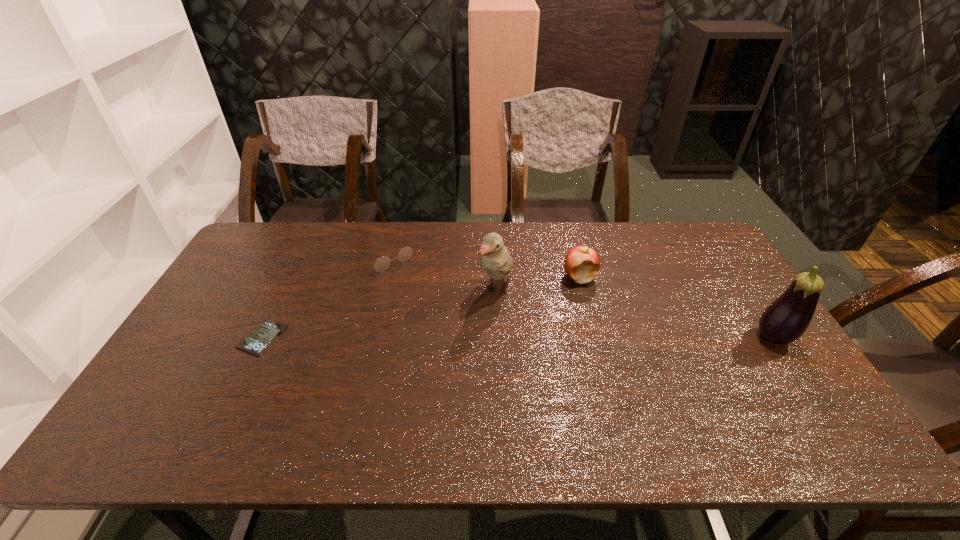
The width and height of the screenshot is (960, 540). Find the location of `the shortest object`. the shortest object is located at coordinates (268, 331).

At what (x,y) coordinates should I click in order to perform the action: click on the leftmost object. Please return your answer as a coordinate pair (x, y). Looking at the image, I should click on (268, 331).

You are a GUI agent. You are given a task and a screenshot of the screen. Output one action in this format:
    pyautogui.click(x=<x>, y=<y>)
    Task: Click on the eggplant
    
    Given the screenshot: What is the action you would take?
    pyautogui.click(x=785, y=320)

At what (x,y) coordinates should I click in order to perform the action: click on the third shortest object. Please return your answer as a coordinate pair (x, y). The width and height of the screenshot is (960, 540). Looking at the image, I should click on (582, 263).

This screenshot has height=540, width=960. What are the coordinates of `apple` in the screenshot? It's located at (582, 263).

The width and height of the screenshot is (960, 540). Find the location of `the second object from left to right`. the second object from left to right is located at coordinates (382, 263).

The width and height of the screenshot is (960, 540). I want to click on the second shortest object, so click(382, 263).

Identify the location of the third object from right to left. This screenshot has height=540, width=960. (496, 260).

Locate an element on the screen. This screenshot has width=960, height=540. free space located 0.240m on the right of the shortest object is located at coordinates (370, 339).

Find the location of a particular element. The height and width of the screenshot is (540, 960). vacant space situated on the left of the eggplant is located at coordinates (615, 337).